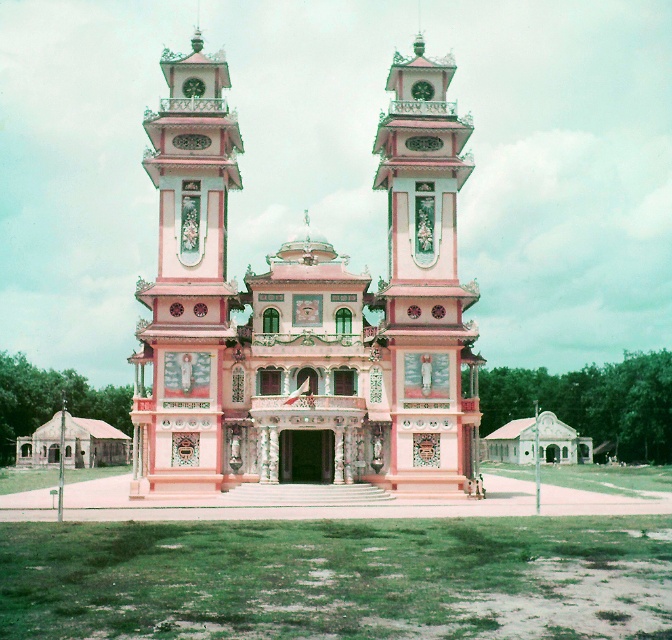
You are standing in front of the grand building and want to take a photo of the pink glossy clock tower at left and the pink glossy bell tower at center. Which tower should you position to your right side to capture both in the frame?

The pink glossy clock tower at left is to the left of the pink glossy bell tower at center. To capture both in the frame, position the pink glossy bell tower at center to your right side so that the pink glossy clock tower at left is on the left and the bell tower is on the right in your photo.

You are standing at point (206, 392) and want to reach the entrance of the grand building. The entrance is located at the central section between the two towers. If the distance between your current position and the entrance is 321.68 feet, can you estimate how far you need to walk to reach the entrance?

You need to walk 321.68 feet to reach the entrance of the grand building, as that is the distance between your current position at point (206, 392) and the entrance located at the central section between the two towers.